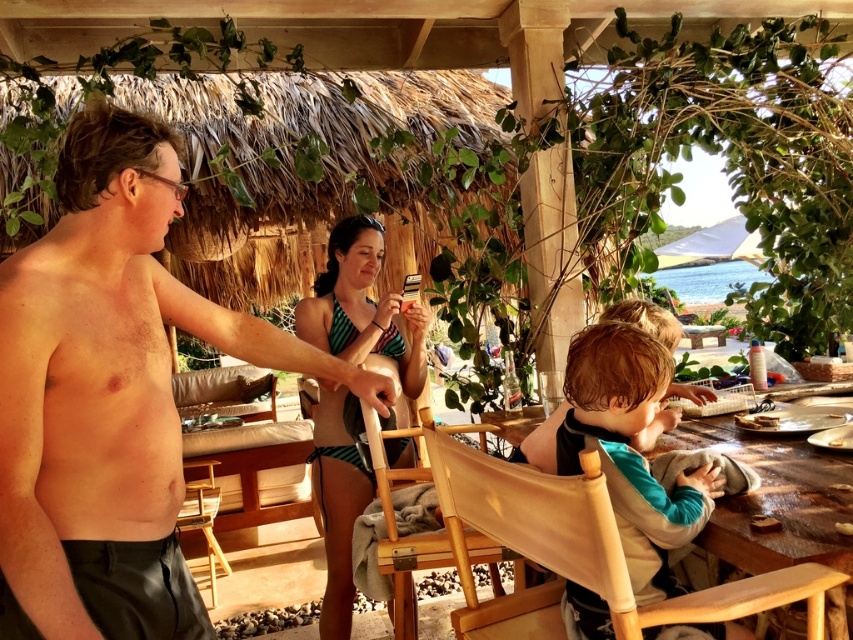
You are standing at the thatched roof structure and want to take a photo of both the point at coordinates point (329, 276) and point (206, 477). Which point should you focus on first to ensure both are in clear view?

You should focus on point (329, 276) first because it is closer to the camera than point (206, 477). This ensures both points are in focus as you adjust the camera settings.

You are planning to set up a small table and chair set for a beachside event. You have a wooden table at lower right and a wooden chair at lower left. Which object is wider so that it can accommodate more items?

The wooden table at lower right is wider than the wooden chair at lower left, so it can accommodate more items.